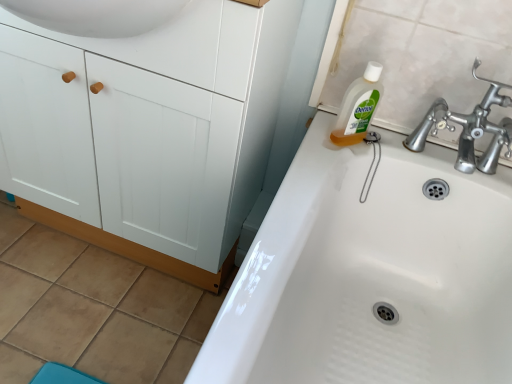
This screenshot has width=512, height=384. What are the coordinates of `unoccupied region to the right of clear liquid soap at upper right` in the screenshot? It's located at (407, 146).